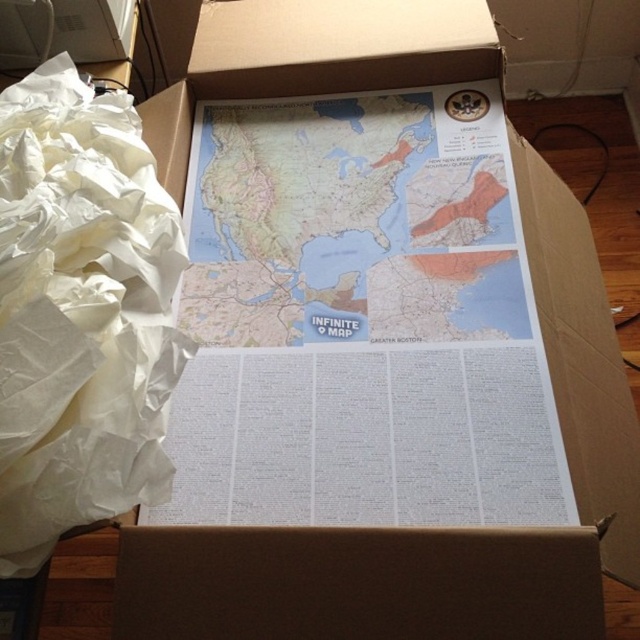
Question: Does matte paper map at center appear on the right side of white crumpled paper at left?

Choices:
 (A) no
 (B) yes

Answer: (B)

Question: Is matte paper map at center behind white crumpled paper at left?

Choices:
 (A) no
 (B) yes

Answer: (B)

Question: Which of the following is the closest to the observer?

Choices:
 (A) white crumpled paper at left
 (B) matte paper map at center

Answer: (A)

Question: Considering the relative positions of matte paper map at center and white crumpled paper at left in the image provided, where is matte paper map at center located with respect to white crumpled paper at left?

Choices:
 (A) above
 (B) below

Answer: (A)